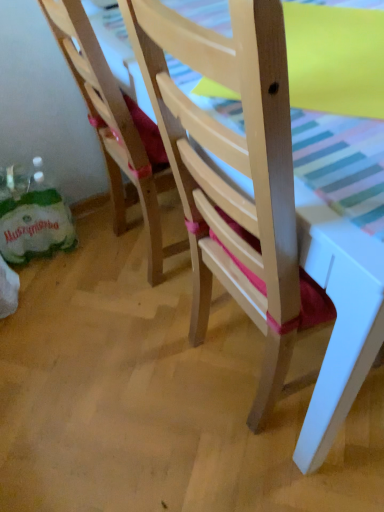
Image resolution: width=384 pixels, height=512 pixels. What do you see at coordinates (335, 58) in the screenshot?
I see `matte yellow table at upper right` at bounding box center [335, 58].

The height and width of the screenshot is (512, 384). I want to click on wooden chair at center, marked as the second chair in a left-to-right arrangement, so click(260, 208).

The image size is (384, 512). In order to click on wooden chair at lower left, the second chair when ordered from right to left in this screenshot , I will do tap(115, 128).

This screenshot has width=384, height=512. I want to click on matte yellow table at upper right, so click(335, 58).

Which is behind, point (112, 95) or point (309, 86)?

Point (112, 95)

Do you think wooden chair at lower left, arranged as the first chair when viewed from the left, is within matte yellow table at upper right, or outside of it?

wooden chair at lower left, arranged as the first chair when viewed from the left, exists outside the volume of matte yellow table at upper right.

Is wooden chair at lower left, the second chair when ordered from right to left, turned away from matte yellow table at upper right?

No, wooden chair at lower left, the second chair when ordered from right to left,'s orientation is not away from matte yellow table at upper right.

Is wooden chair at lower left, the second chair when ordered from right to left, to the left of matte yellow table at upper right from the viewer's perspective?

Yes, wooden chair at lower left, the second chair when ordered from right to left, is to the left of matte yellow table at upper right.

From the picture: Could you tell me if wooden chair at lower left, the second chair when ordered from right to left, is facing wooden chair at center, which is the first chair from right to left?

No, wooden chair at lower left, the second chair when ordered from right to left, is not oriented towards wooden chair at center, which is the first chair from right to left.

From a real-world perspective, is wooden chair at lower left, the second chair when ordered from right to left, below wooden chair at center, which is the first chair from right to left?

Yes, from a real-world perspective, wooden chair at lower left, the second chair when ordered from right to left, is beneath wooden chair at center, which is the first chair from right to left.

Considering the positions of objects wooden chair at lower left, the second chair when ordered from right to left, and wooden chair at center, marked as the second chair in a left-to-right arrangement, in the image provided, who is behind, wooden chair at lower left, the second chair when ordered from right to left, or wooden chair at center, marked as the second chair in a left-to-right arrangement,?

wooden chair at lower left, the second chair when ordered from right to left, is behind.

Can wooden chair at center, which is the first chair from right to left, be found inside wooden chair at lower left, the second chair when ordered from right to left?

No, wooden chair at center, which is the first chair from right to left, is not a part of wooden chair at lower left, the second chair when ordered from right to left.

Between point (210, 279) and point (383, 101), which one is positioned in front?

Point (383, 101)

Is wooden chair at center, marked as the second chair in a left-to-right arrangement, positioned with its back to matte yellow table at upper right?

That's not correct — wooden chair at center, marked as the second chair in a left-to-right arrangement, is not looking away from matte yellow table at upper right.

Who is smaller, wooden chair at center, which is the first chair from right to left, or matte yellow table at upper right?

Smaller between the two is matte yellow table at upper right.

Can you confirm if wooden chair at center, marked as the second chair in a left-to-right arrangement, is taller than matte yellow table at upper right?

Correct, wooden chair at center, marked as the second chair in a left-to-right arrangement, is much taller as matte yellow table at upper right.

Is matte yellow table at upper right thinner than wooden chair at lower left, arranged as the first chair when viewed from the left?

Yes.

From a real-world perspective, is matte yellow table at upper right on top of wooden chair at lower left, the second chair when ordered from right to left?

Yes, from a real-world perspective, matte yellow table at upper right is over wooden chair at lower left, the second chair when ordered from right to left

Is matte yellow table at upper right facing towards wooden chair at lower left, the second chair when ordered from right to left?

No, matte yellow table at upper right is not facing towards wooden chair at lower left, the second chair when ordered from right to left.

In the image, is matte yellow table at upper right positioned in front of or behind wooden chair at lower left, arranged as the first chair when viewed from the left?

Clearly, matte yellow table at upper right is in front of wooden chair at lower left, arranged as the first chair when viewed from the left.

Measure the distance from matte yellow table at upper right to wooden chair at center, marked as the second chair in a left-to-right arrangement.

They are 14.44 inches apart.

Is wooden chair at center, marked as the second chair in a left-to-right arrangement, a part of matte yellow table at upper right?

No, wooden chair at center, marked as the second chair in a left-to-right arrangement, is not inside matte yellow table at upper right.

Which is less distant, (328, 61) or (232, 269)?

The point (328, 61) is in front.

Is matte yellow table at upper right not close to wooden chair at center, marked as the second chair in a left-to-right arrangement?

That's not correct — matte yellow table at upper right is a little close to wooden chair at center, marked as the second chair in a left-to-right arrangement.

Which is behind, point (200, 326) or point (113, 225)?

The point (113, 225) is farther.

Is wooden chair at center, which is the first chair from right to left, spatially inside wooden chair at lower left, arranged as the first chair when viewed from the left, or outside of it?

wooden chair at center, which is the first chair from right to left, is not enclosed by wooden chair at lower left, arranged as the first chair when viewed from the left.

From a real-world perspective, who is located higher, wooden chair at center, which is the first chair from right to left, or wooden chair at lower left, the second chair when ordered from right to left?

wooden chair at center, which is the first chair from right to left, is physically above.

Would you say wooden chair at center, marked as the second chair in a left-to-right arrangement, is to the left or to the right of wooden chair at lower left, the second chair when ordered from right to left, in the picture?

In the image, wooden chair at center, marked as the second chair in a left-to-right arrangement, appears on the right side of wooden chair at lower left, the second chair when ordered from right to left.

Locate an element on the screen. The height and width of the screenshot is (512, 384). chair that is behind the matte yellow table at upper right is located at coordinates (115, 128).

Image resolution: width=384 pixels, height=512 pixels. What are the coordinates of `chair above the wooden chair at lower left, the second chair when ordered from right to left (from a real-world perspective)` in the screenshot? It's located at (260, 208).

Estimate the real-world distances between objects in this image. Which object is closer to wooden chair at lower left, arranged as the first chair when viewed from the left, matte yellow table at upper right or wooden chair at center, marked as the second chair in a left-to-right arrangement?

Among the two, matte yellow table at upper right is located nearer to wooden chair at lower left, arranged as the first chair when viewed from the left.

Which object lies nearer to the anchor point wooden chair at lower left, the second chair when ordered from right to left, wooden chair at center, marked as the second chair in a left-to-right arrangement, or matte yellow table at upper right?

matte yellow table at upper right is closer to wooden chair at lower left, the second chair when ordered from right to left.

When comparing their distances from wooden chair at center, which is the first chair from right to left, does wooden chair at lower left, the second chair when ordered from right to left, or matte yellow table at upper right seem closer?

Among the two, matte yellow table at upper right is located nearer to wooden chair at center, which is the first chair from right to left.

Considering their positions, is wooden chair at lower left, the second chair when ordered from right to left, positioned further to matte yellow table at upper right than wooden chair at center, which is the first chair from right to left?

wooden chair at center, which is the first chair from right to left, is positioned further to the anchor matte yellow table at upper right.

Based on their spatial positions, is matte yellow table at upper right or wooden chair at lower left, arranged as the first chair when viewed from the left, further from wooden chair at center, which is the first chair from right to left?

wooden chair at lower left, arranged as the first chair when viewed from the left.

Which object lies further to the anchor point matte yellow table at upper right, wooden chair at center, which is the first chair from right to left, or wooden chair at lower left, arranged as the first chair when viewed from the left?

wooden chair at center, which is the first chair from right to left.

Where is `table top located between wooden chair at center, which is the first chair from right to left, and wooden chair at lower left, the second chair when ordered from right to left, in the depth direction`? This screenshot has height=512, width=384. table top located between wooden chair at center, which is the first chair from right to left, and wooden chair at lower left, the second chair when ordered from right to left, in the depth direction is located at coordinates (335, 58).